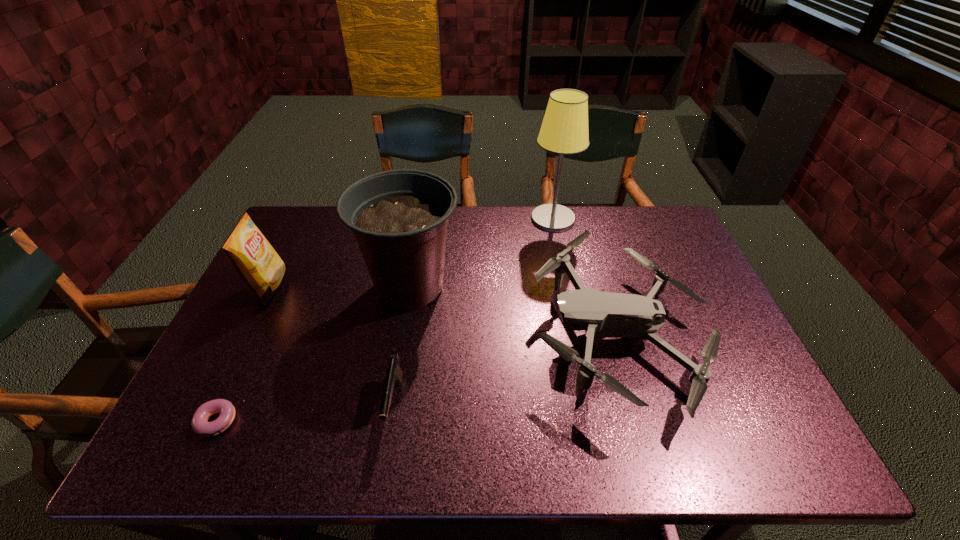
Where is `the farthest object`? the farthest object is located at coordinates (564, 130).

At what (x,y) coordinates should I click in order to perform the action: click on table lamp. Please return your answer as a coordinate pair (x, y). The image size is (960, 540). Looking at the image, I should click on click(x=564, y=130).

The height and width of the screenshot is (540, 960). What are the coordinates of `flowerpot` in the screenshot? It's located at (399, 218).

Locate an element on the screen. Image resolution: width=960 pixels, height=540 pixels. the fourth shortest object is located at coordinates (257, 264).

Locate an element on the screen. The image size is (960, 540). the fourth tallest object is located at coordinates (601, 315).

This screenshot has width=960, height=540. Identify the location of the second shortest object. (394, 374).

Where is `doughnut`? The width and height of the screenshot is (960, 540). doughnut is located at coordinates (200, 426).

Locate an element on the screen. Image resolution: width=960 pixels, height=540 pixels. blank space located on the left of the farthest object is located at coordinates (501, 219).

In order to click on blank space located on the front of the flowerpot in this screenshot , I will do `click(390, 410)`.

Where is `vacant space situated on the front-facing side of the crisp (potato chip)`? vacant space situated on the front-facing side of the crisp (potato chip) is located at coordinates (347, 287).